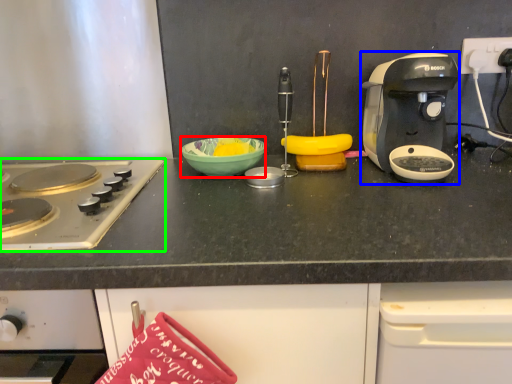
Question: Based on their relative distances, which object is nearer to bowl (highlighted by a red box)? Choose from coffee maker (highlighted by a blue box) and gas stove (highlighted by a green box).

Choices:
 (A) coffee maker
 (B) gas stove

Answer: (B)